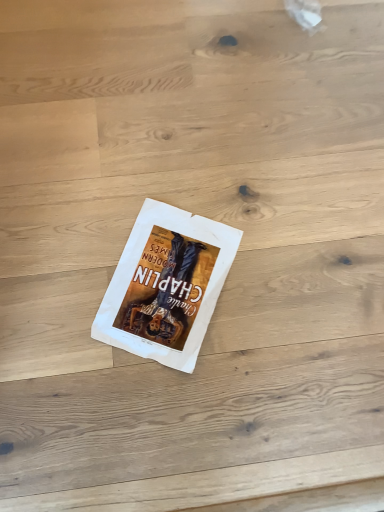
Where is `vacant space underneath white paper book at center (from a real-world perspective)`? vacant space underneath white paper book at center (from a real-world perspective) is located at coordinates (160, 281).